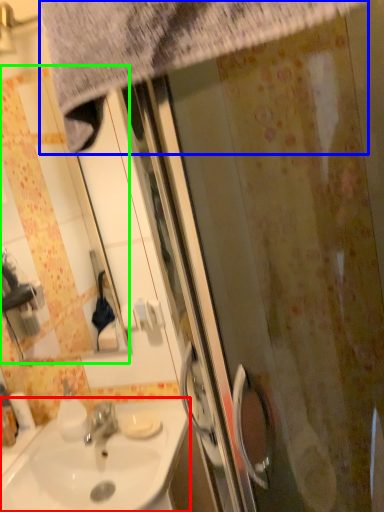
Question: Which object is the farthest from sink (highlighted by a red box)? Choose among these: shower curtain (highlighted by a blue box) or mirror (highlighted by a green box).

Choices:
 (A) shower curtain
 (B) mirror

Answer: (B)